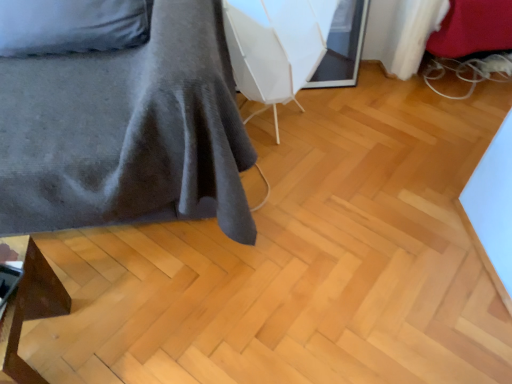
Question: Should I look upward or downward to see white plastic swivel chair at center?

Choices:
 (A) up
 (B) down

Answer: (A)

Question: Does velvet grey bedspread at left, positioned as the second furniture in bottom-to-top order, have a lesser width compared to white plastic swivel chair at center?

Choices:
 (A) no
 (B) yes

Answer: (A)

Question: Is velvet grey bedspread at left, positioned as the second furniture in bottom-to-top order, to the left of white plastic swivel chair at center from the viewer's perspective?

Choices:
 (A) no
 (B) yes

Answer: (B)

Question: Considering the relative sizes of velvet grey bedspread at left, the 1th furniture in the top-to-bottom sequence, and white plastic swivel chair at center in the image provided, is velvet grey bedspread at left, the 1th furniture in the top-to-bottom sequence, bigger than white plastic swivel chair at center?

Choices:
 (A) yes
 (B) no

Answer: (A)

Question: Considering the relative sizes of velvet grey bedspread at left, the 1th furniture in the top-to-bottom sequence, and white plastic swivel chair at center in the image provided, is velvet grey bedspread at left, the 1th furniture in the top-to-bottom sequence, smaller than white plastic swivel chair at center?

Choices:
 (A) no
 (B) yes

Answer: (A)

Question: Is velvet grey bedspread at left, positioned as the second furniture in bottom-to-top order, positioned in front of white plastic swivel chair at center?

Choices:
 (A) no
 (B) yes

Answer: (B)

Question: Is the depth of velvet grey bedspread at left, the 1th furniture in the top-to-bottom sequence, greater than that of white plastic swivel chair at center?

Choices:
 (A) yes
 (B) no

Answer: (B)

Question: Is matte brown wooden stool at lower left, which ranks as the 2th furniture in top-to-bottom order, positioned with its back to velvet grey bedspread at left, positioned as the second furniture in bottom-to-top order?

Choices:
 (A) no
 (B) yes

Answer: (B)

Question: From a real-world perspective, is matte brown wooden stool at lower left, which ranks as the 2th furniture in top-to-bottom order, physically above velvet grey bedspread at left, the 1th furniture in the top-to-bottom sequence?

Choices:
 (A) no
 (B) yes

Answer: (A)

Question: Can you confirm if matte brown wooden stool at lower left, the first furniture ordered from the bottom, is bigger than velvet grey bedspread at left, the 1th furniture in the top-to-bottom sequence?

Choices:
 (A) yes
 (B) no

Answer: (B)

Question: Can you confirm if matte brown wooden stool at lower left, which ranks as the 2th furniture in top-to-bottom order, is thinner than velvet grey bedspread at left, the 1th furniture in the top-to-bottom sequence?

Choices:
 (A) yes
 (B) no

Answer: (A)

Question: Can you confirm if matte brown wooden stool at lower left, which ranks as the 2th furniture in top-to-bottom order, is wider than velvet grey bedspread at left, positioned as the second furniture in bottom-to-top order?

Choices:
 (A) no
 (B) yes

Answer: (A)

Question: Does matte brown wooden stool at lower left, which ranks as the 2th furniture in top-to-bottom order, lie behind velvet grey bedspread at left, positioned as the second furniture in bottom-to-top order?

Choices:
 (A) yes
 (B) no

Answer: (A)

Question: Can you confirm if matte brown wooden stool at lower left, which ranks as the 2th furniture in top-to-bottom order, is thinner than white plastic swivel chair at center?

Choices:
 (A) yes
 (B) no

Answer: (A)